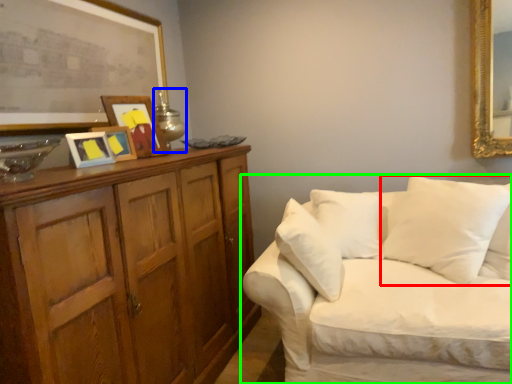
Question: Considering the real-world distances, which object is farthest from pillow (highlighted by a red box)? table lamp (highlighted by a blue box) or studio couch (highlighted by a green box)?

Choices:
 (A) table lamp
 (B) studio couch

Answer: (A)